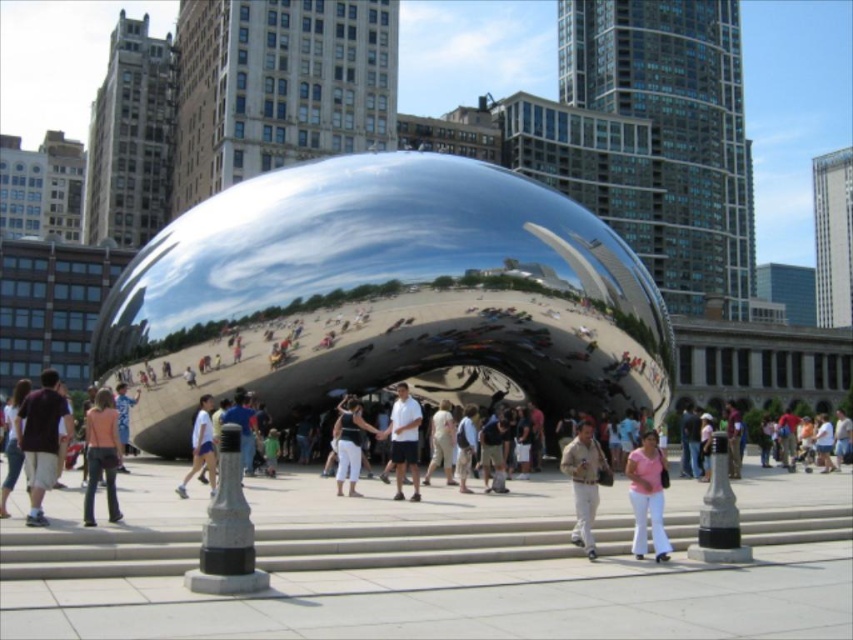
Question: Does dark purple shirt at left appear over white cotton pants at center?

Choices:
 (A) yes
 (B) no

Answer: (A)

Question: Which point is closer to the camera taking this photo?

Choices:
 (A) (663, 470)
 (B) (38, 400)

Answer: (B)

Question: Is matte pink shirt at center positioned before white shirt at center?

Choices:
 (A) no
 (B) yes

Answer: (B)

Question: Which point is farther to the camera?

Choices:
 (A) pink fabric pants at center
 (B) dark purple shirt at left

Answer: (A)

Question: Which of these objects is positioned closest to the dark purple shirt at left?

Choices:
 (A) white cotton pants at center
 (B) white shirt at center
 (C) pink fabric pants at center

Answer: (B)

Question: Is dark purple shirt at left to the right of white cotton pants at center from the viewer's perspective?

Choices:
 (A) no
 (B) yes

Answer: (A)